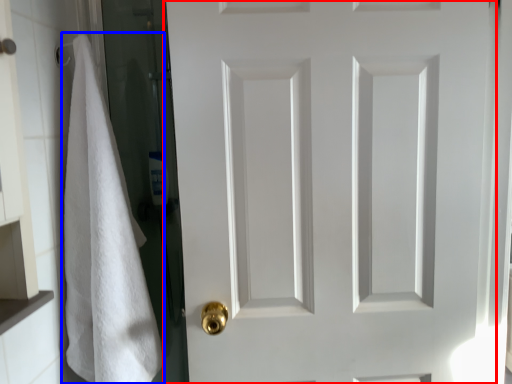
Question: Which object is closer to the camera taking this photo, door (highlighted by a red box) or bath towel (highlighted by a blue box)?

Choices:
 (A) door
 (B) bath towel

Answer: (B)